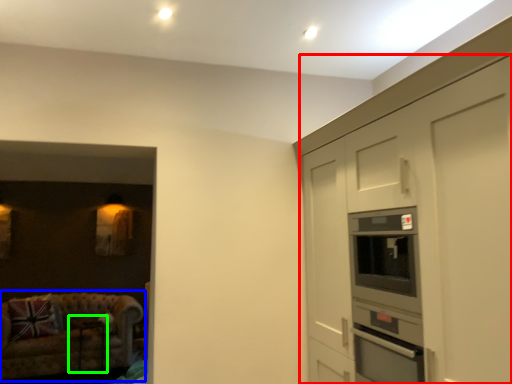
Question: Which object is positioned farthest from cabinetry (highlighted by a red box)? Select from studio couch (highlighted by a blue box) and table (highlighted by a green box).

Choices:
 (A) studio couch
 (B) table

Answer: (B)